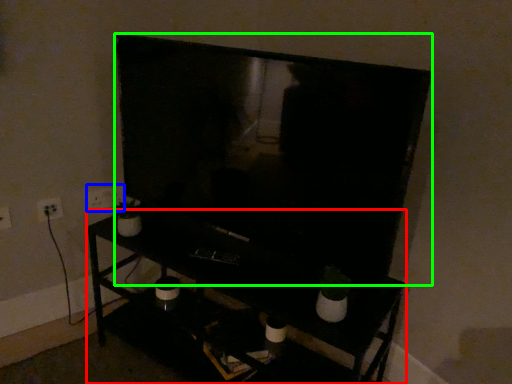
Question: Estimate the real-world distances between objects in this image. Which object is farther from furniture (highlighted by a red box), electric outlet (highlighted by a blue box) or television (highlighted by a green box)?

Choices:
 (A) electric outlet
 (B) television

Answer: (A)